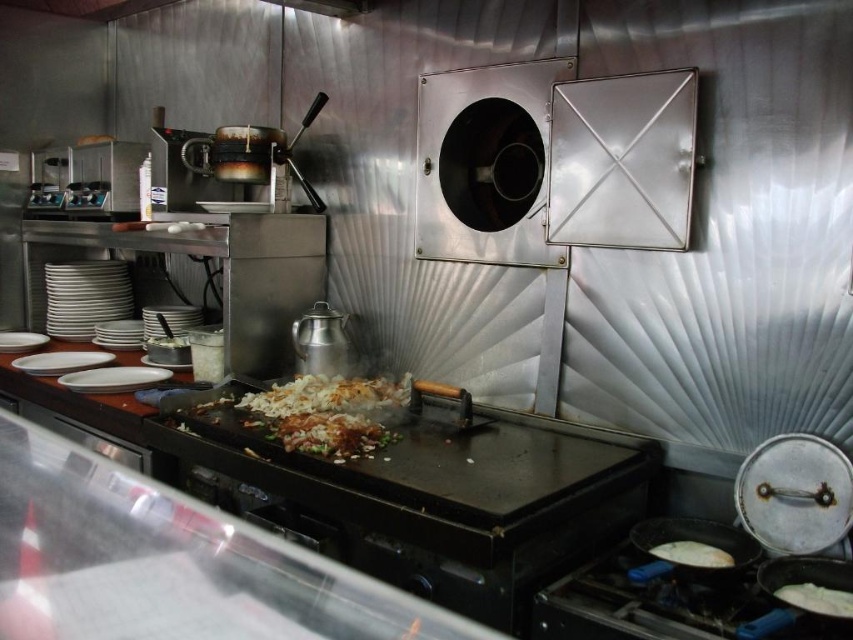
The image size is (853, 640). In order to click on white fluffy pancake at lower right in this screenshot , I will do `click(816, 598)`.

Consider the image. Does white fluffy pancake at lower right appear under white matte flatbread at lower right?

Yes.

Identify the location of white fluffy pancake at lower right. Image resolution: width=853 pixels, height=640 pixels. (816, 598).

Does white matte plate at center have a larger size compared to white fluffy pancake at lower right?

Yes.

Which of these two, white matte plate at center or white fluffy pancake at lower right, stands taller?

Standing taller between the two is white matte plate at center.

The height and width of the screenshot is (640, 853). Describe the element at coordinates (114, 378) in the screenshot. I see `white matte plate at center` at that location.

Locate an element on the screen. white matte plate at center is located at coordinates (114, 378).

Is white matte plate at center to the right of white matte flatbread at lower right from the viewer's perspective?

Incorrect, white matte plate at center is not on the right side of white matte flatbread at lower right.

From the picture: Is white matte plate at center taller than white matte flatbread at lower right?

Correct, white matte plate at center is much taller as white matte flatbread at lower right.

Does point (144, 387) come in front of point (654, 547)?

No, (144, 387) is behind (654, 547).

Image resolution: width=853 pixels, height=640 pixels. I want to click on white matte plate at center, so click(114, 378).